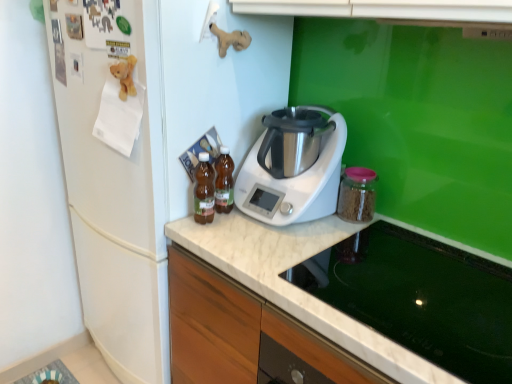
Where is `vacant space that is in between white plastic appliance at center, which is counted as the 2th kitchen appliance, starting from the right, and brown glass bottles at center, which is the 1th kitchen appliance in left-to-right order`? vacant space that is in between white plastic appliance at center, which is counted as the 2th kitchen appliance, starting from the right, and brown glass bottles at center, which is the 1th kitchen appliance in left-to-right order is located at coordinates (242, 228).